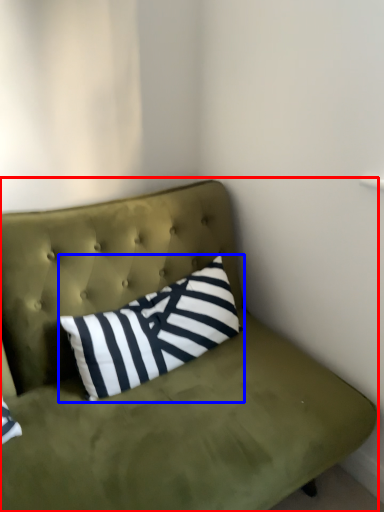
Question: Which point is further to the camera, studio couch (highlighted by a red box) or pillow (highlighted by a blue box)?

Choices:
 (A) studio couch
 (B) pillow

Answer: (B)